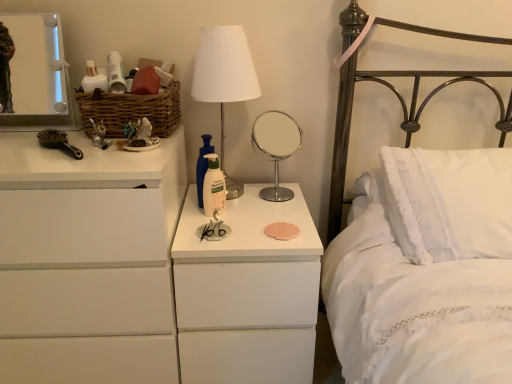
Locate an element on the screen. This screenshot has height=384, width=512. vacant space in front of woven brown basket at upper left is located at coordinates (100, 154).